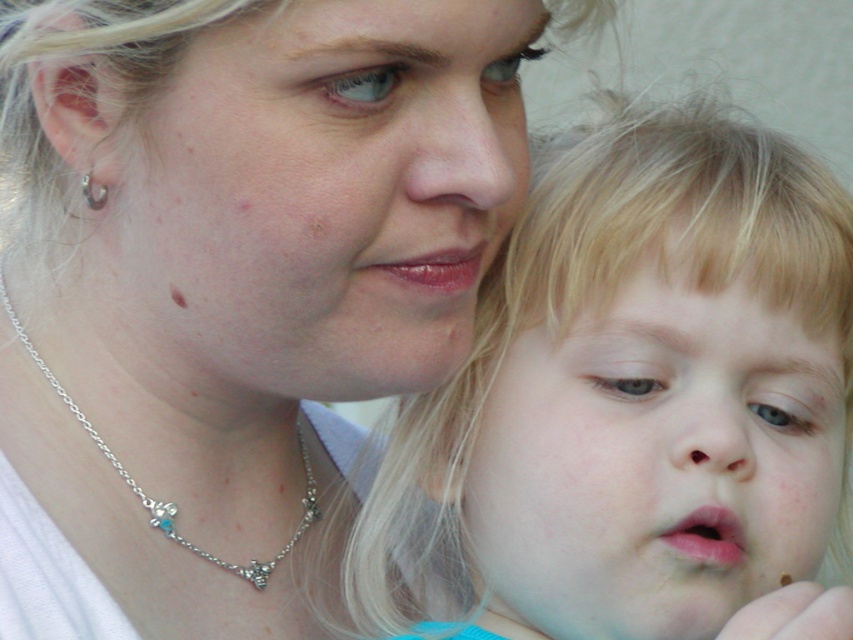
Question: Is matte pink lips at lower center behind pink glossy lips at center?

Choices:
 (A) yes
 (B) no

Answer: (B)

Question: Among these objects, which one is farthest from the camera?

Choices:
 (A) pink glossy lips at center
 (B) silver/glass necklace at center
 (C) smooth blonde hair at center

Answer: (B)

Question: Is matte silver necklace at center below matte pink lips at lower center?

Choices:
 (A) no
 (B) yes

Answer: (A)

Question: Which point is farther to the camera?

Choices:
 (A) matte pink lips at lower center
 (B) matte silver necklace at center

Answer: (A)

Question: Is smooth blonde hair at center smaller than matte pink lips at lower center?

Choices:
 (A) yes
 (B) no

Answer: (B)

Question: Which point is farther from the camera taking this photo?

Choices:
 (A) (730, 545)
 (B) (70, 413)

Answer: (B)